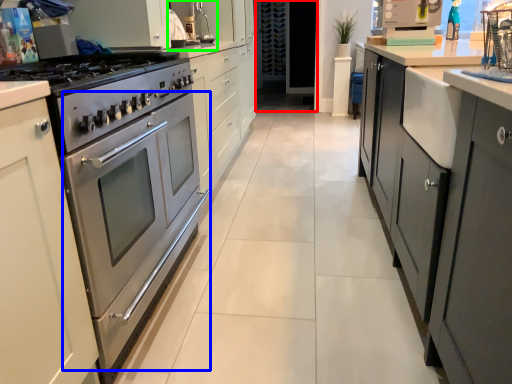
Question: Which is farther away from glass door (highlighted by a red box)? oven (highlighted by a blue box) or sink (highlighted by a green box)?

Choices:
 (A) oven
 (B) sink

Answer: (A)